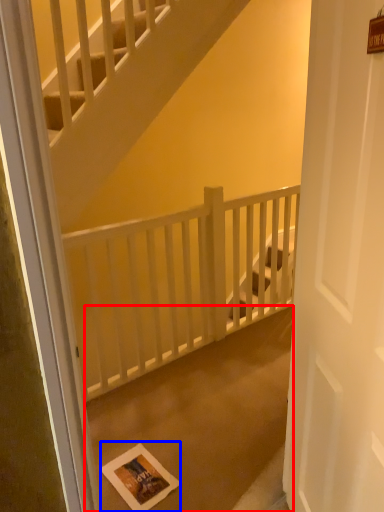
Question: Which object is closer to the camera taking this photo, concrete (highlighted by a red box) or postcard (highlighted by a blue box)?

Choices:
 (A) concrete
 (B) postcard

Answer: (A)